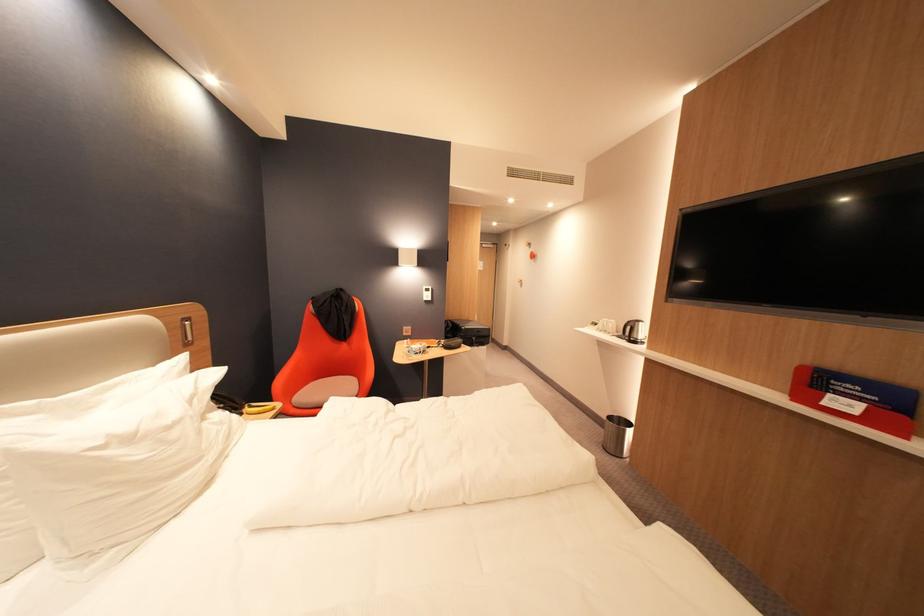
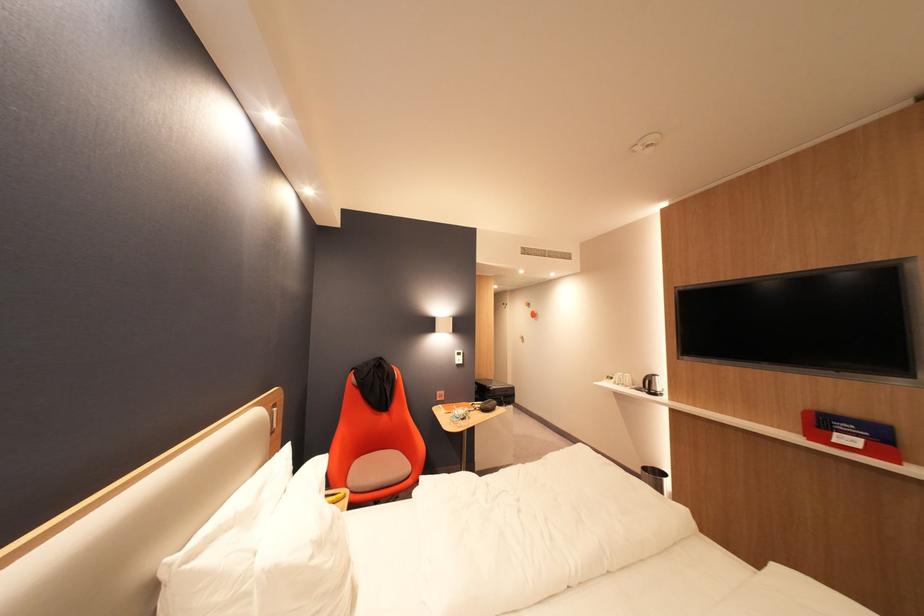
The point at (841,395) is marked in the first image. Where is the corresponding point in the second image?

(846, 435)